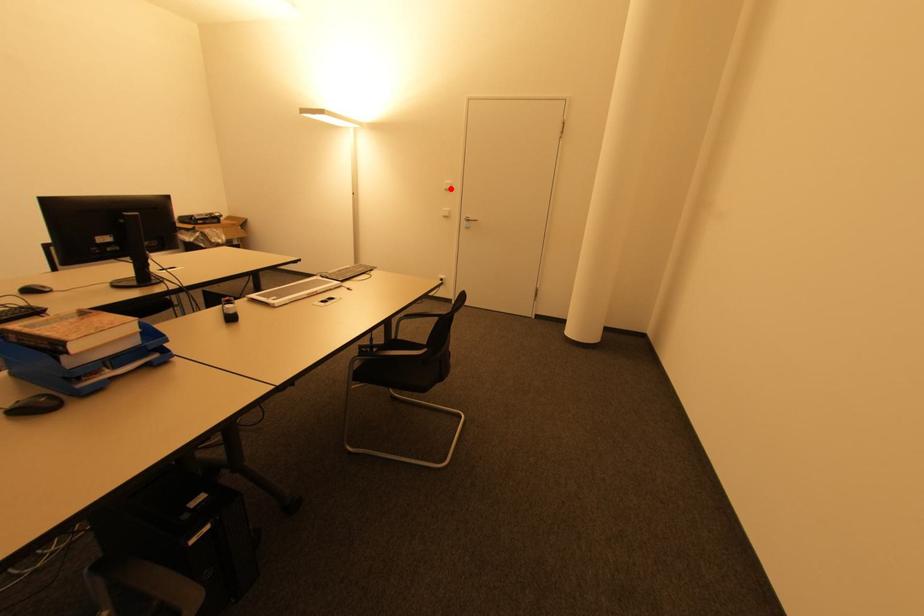
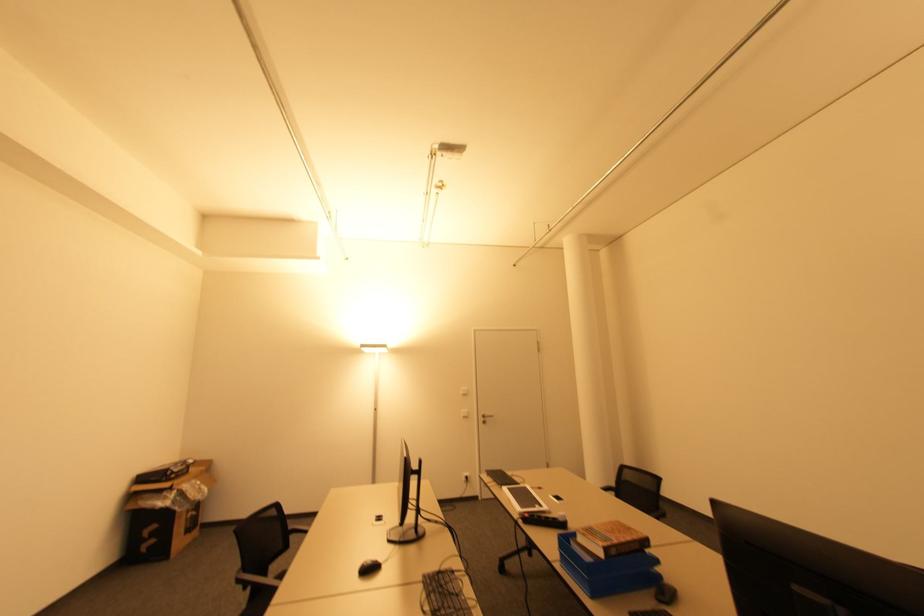
Question: I am providing you with two images of the same scene from different viewpoints. Image1 has a red point marked. In image2, the corresponding 3D location appears at what relative position? Reply with the corresponding letter.

Choices:
 (A) Closer
 (B) Farther

Answer: (B)